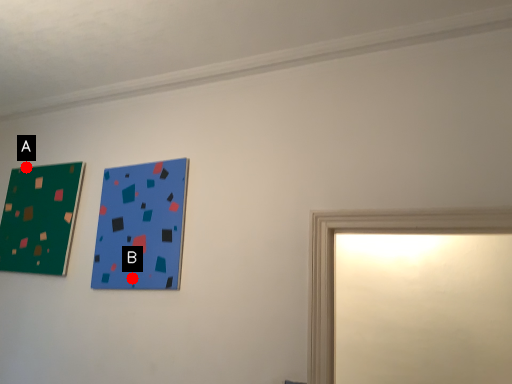
Question: Two points are circled on the image, labeled by A and B beside each circle. Among these points, which one is farthest from the camera?

Choices:
 (A) A is further
 (B) B is further

Answer: (A)